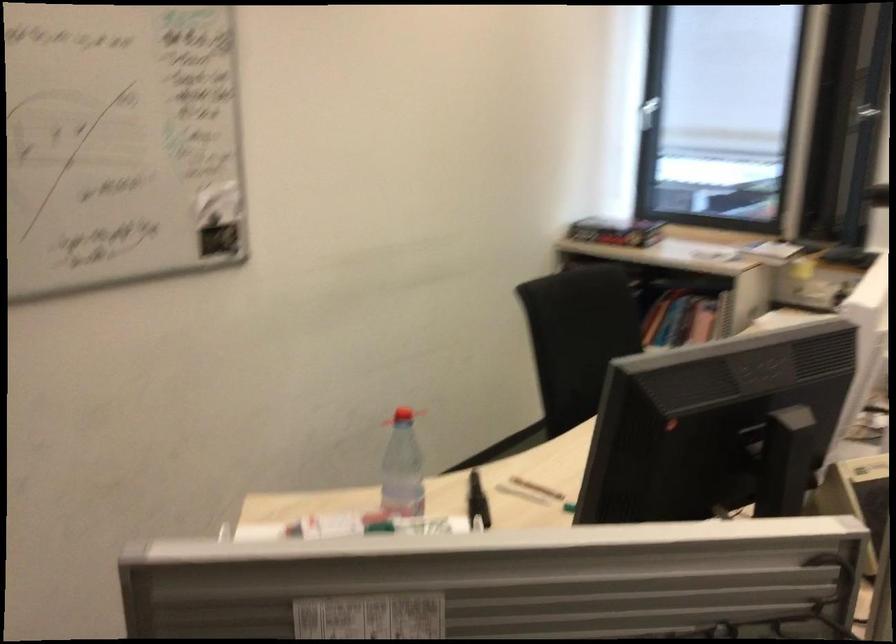
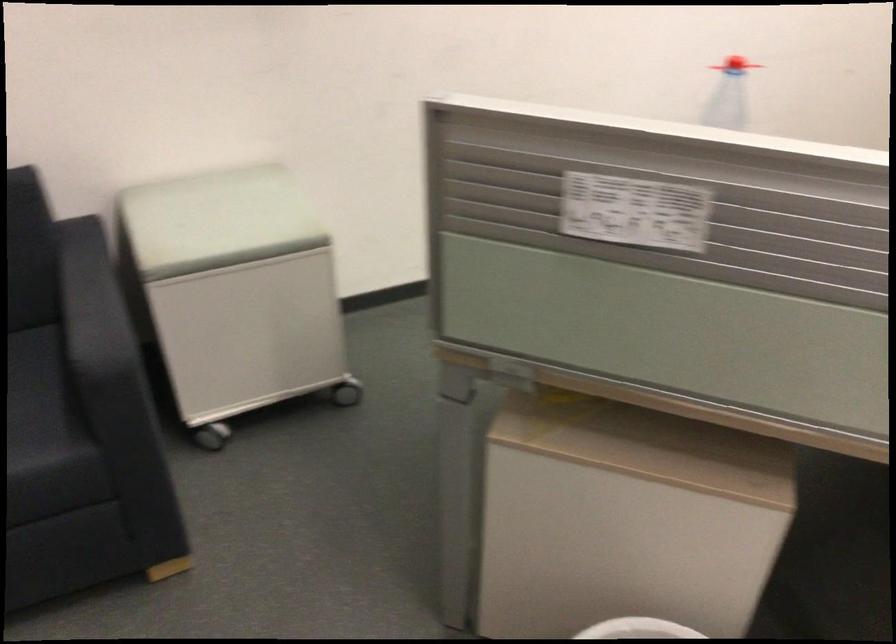
How did the camera likely rotate?

The rotation direction of the camera is left-down.